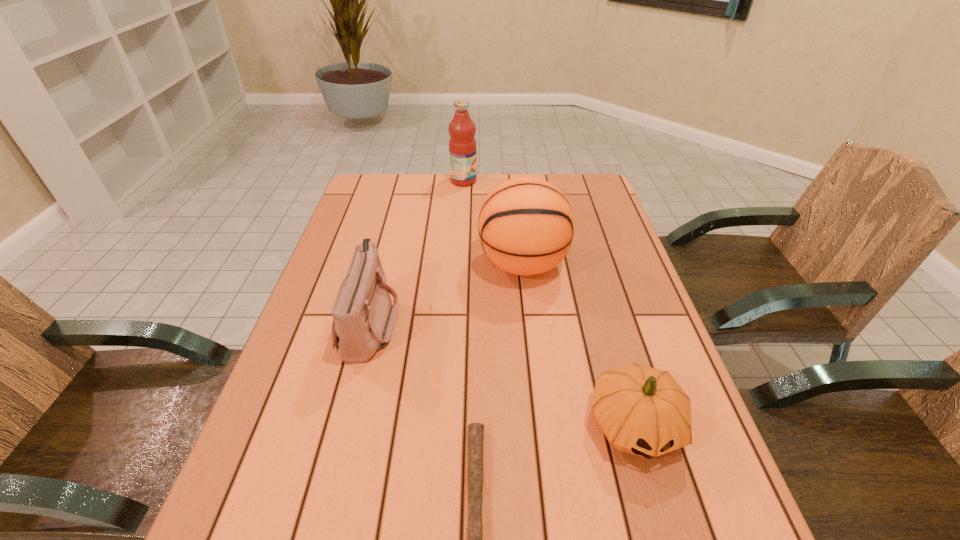
Where is `the farthest object`? This screenshot has width=960, height=540. the farthest object is located at coordinates (462, 145).

Where is `basketball`? basketball is located at coordinates (526, 225).

Locate an element on the screen. shoulder bag is located at coordinates (363, 316).

The width and height of the screenshot is (960, 540). Identify the location of gourd. (641, 410).

Locate an element on the screen. The image size is (960, 540). free space located 0.220m on the front label of the fruit juice is located at coordinates coord(539,181).

Locate an element on the screen. The height and width of the screenshot is (540, 960). free point located on the back of the basketball is located at coordinates (518, 224).

Locate an element on the screen. vacant region located 0.190m on the front pocket of the leftmost object is located at coordinates (477, 322).

Where is `vacant point located on the side of the gourd with the carved face`? The width and height of the screenshot is (960, 540). vacant point located on the side of the gourd with the carved face is located at coordinates (660, 515).

The image size is (960, 540). In order to click on object at the far edge in this screenshot , I will do `click(462, 145)`.

Locate an element on the screen. object positioned at the left edge is located at coordinates (363, 316).